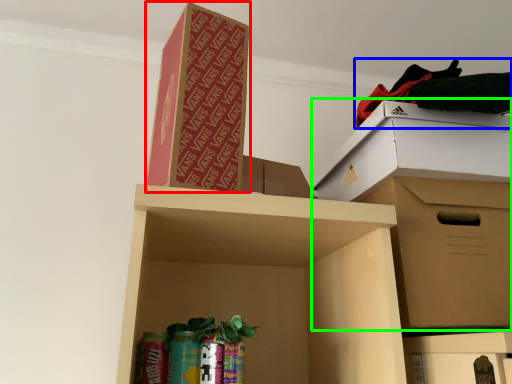
Question: Which object is positioned farthest from cardboard box (highlighted by a red box)? Select from clothing (highlighted by a blue box) and cardboard box (highlighted by a green box).

Choices:
 (A) clothing
 (B) cardboard box

Answer: (B)